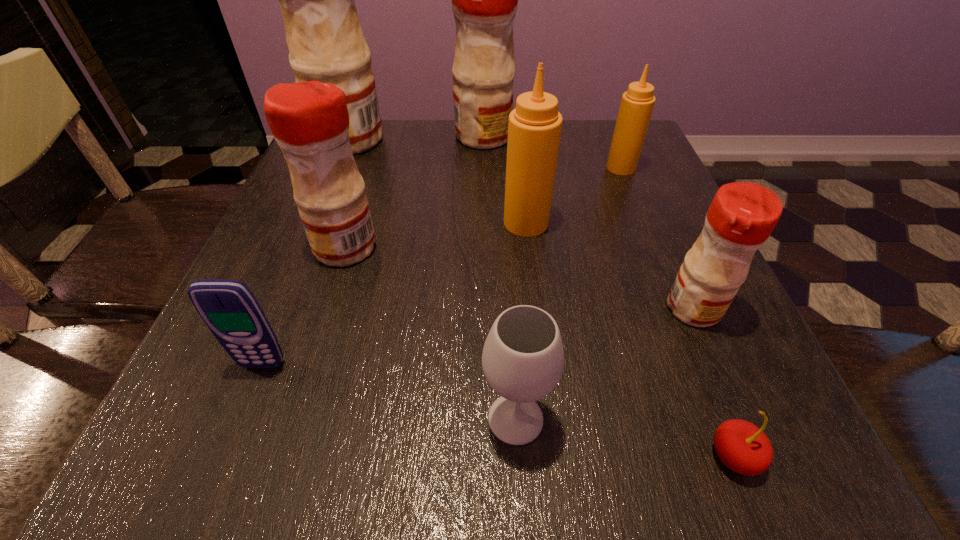
Locate an element on the screen. red condiment that is the third closest to the second smallest red condiment is located at coordinates (742, 215).